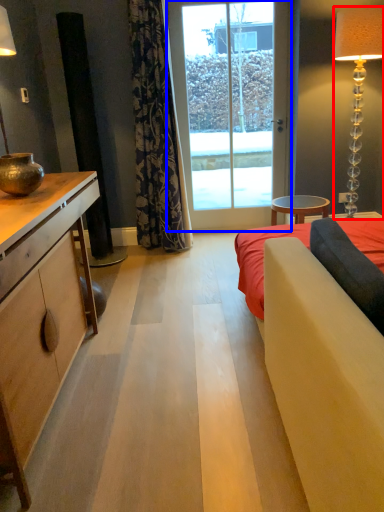
Question: Which point is closer to the camera, lamp (highlighted by a red box) or glass door (highlighted by a blue box)?

Choices:
 (A) lamp
 (B) glass door

Answer: (A)